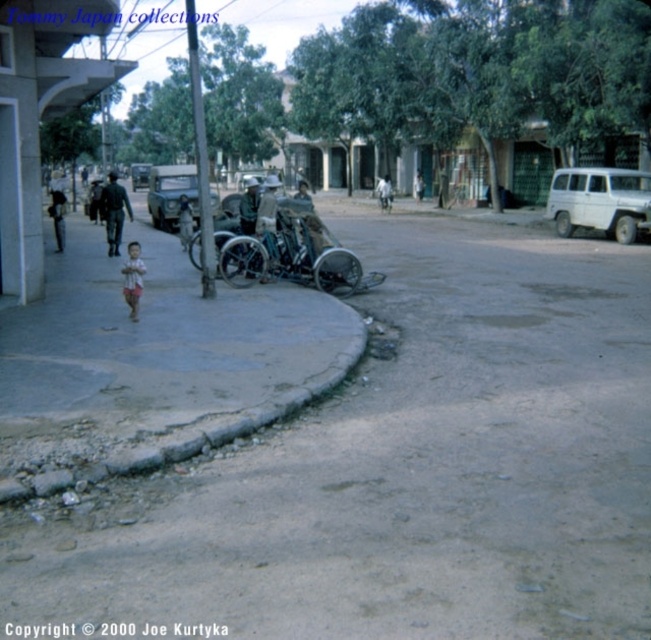
You are a delivery person trying to park your metallic silver car at center near the gray concrete curb at lower left. Can you safely park the car so that it is aligned with the curb?

The gray concrete curb at lower left is positioned under the metallic silver car at center, so the car is already aligned with the curb.

You are driving a car that requires a minimum of 50 meters to safely overtake another vehicle. You see a white matte van at right and a metallic silver car at center on the road. Is there enough space between them to safely overtake?

The white matte van at right and metallic silver car at center are 49.04 meters apart, which is less than the required 50 meters for safe overtaking. Therefore, there is not enough space between them to safely overtake.

You are a delivery driver who needs to park your vehicle in this area. You have a white matte van at right and a metallic silver car at center. Which vehicle is blocking the other one?

The white matte van at right is positioned under metallic silver car at center, meaning the metallic silver car at center is blocking the white matte van at right.